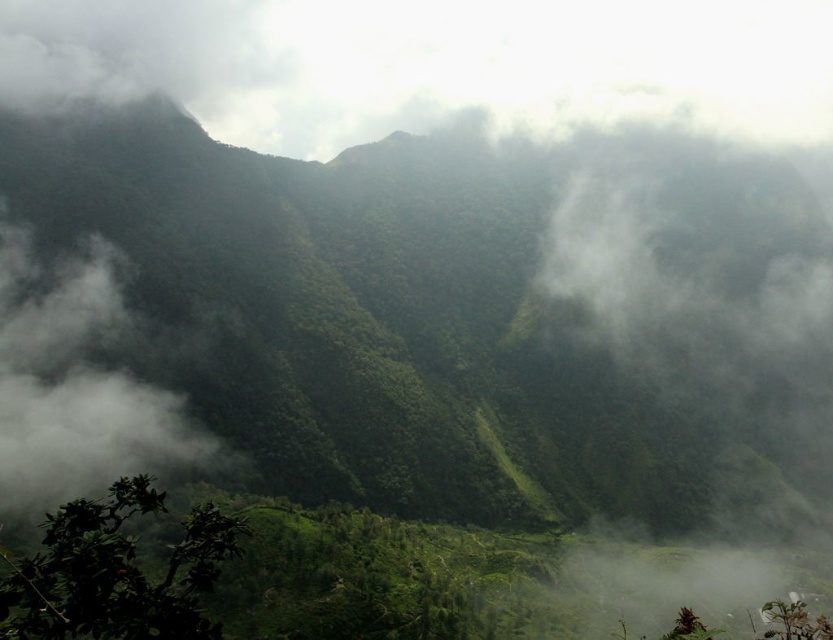
Does white fluffy cloud at left have a lesser width compared to green leafy bush at lower left?

Indeed, white fluffy cloud at left has a lesser width compared to green leafy bush at lower left.

Which is in front, point (28, 481) or point (77, 627)?

Point (77, 627)

Who is more distant from viewer, [168,451] or [63,602]?

Point [168,451]

This screenshot has height=640, width=833. In order to click on white fluffy cloud at left in this screenshot , I will do `click(76, 387)`.